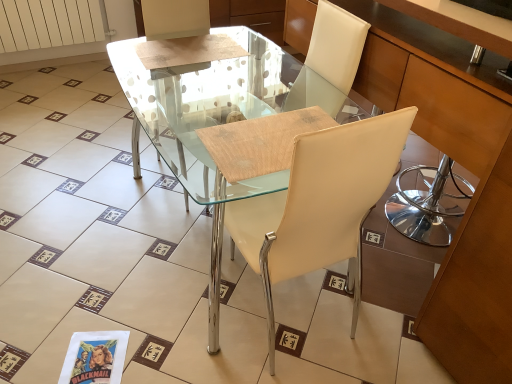
Question: Considering the positions of transparent glass table at center and matte wood cabinet at center in the image, is transparent glass table at center bigger or smaller than matte wood cabinet at center?

Choices:
 (A) big
 (B) small

Answer: (B)

Question: From the image's perspective, is transparent glass table at center positioned above or below matte wood cabinet at center?

Choices:
 (A) below
 (B) above

Answer: (A)

Question: Considering the real-world distances, which object is farthest from the transparent glass table at center?

Choices:
 (A) white matte radiator at upper left
 (B) matte white chair at center
 (C) matte wood cabinet at center

Answer: (A)

Question: Which object is positioned closest to the transparent glass table at center?

Choices:
 (A) matte wood cabinet at center
 (B) white matte radiator at upper left
 (C) matte white chair at center

Answer: (C)